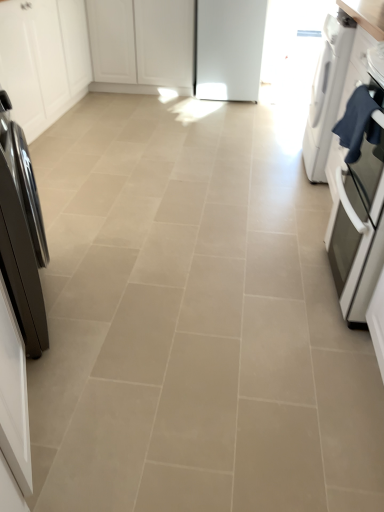
At what (x,y) coordinates should I click in order to perform the action: click on free space in front of shiny black refrigerator at left, the 1th home appliance from the left. Please return your answer as a coordinate pair (x, y). Looking at the image, I should click on (72, 380).